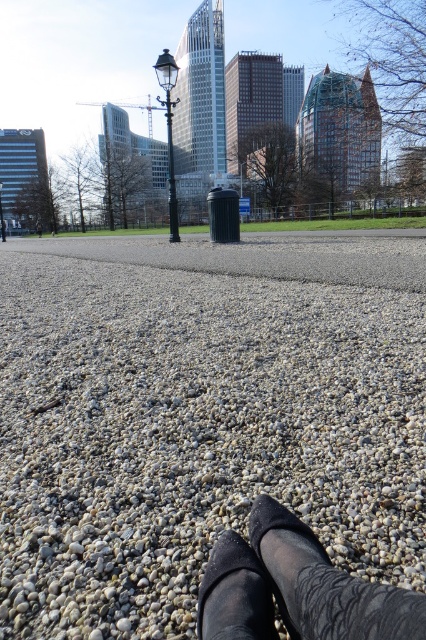
Question: Does gray pebbled gravel at center appear on the left side of black fabric shoes at center?

Choices:
 (A) yes
 (B) no

Answer: (A)

Question: Can you confirm if black fabric shoes at center is smaller than black suede shoe at lower center?

Choices:
 (A) yes
 (B) no

Answer: (B)

Question: Which point is closer to the camera?

Choices:
 (A) black fabric shoes at center
 (B) gray pebbled gravel at center

Answer: (A)

Question: Among these points, which one is nearest to the camera?

Choices:
 (A) (198, 628)
 (B) (37, 582)
 (C) (399, 628)

Answer: (C)

Question: Based on their relative distances, which object is farther from the black fabric shoes at center?

Choices:
 (A) gray pebbled gravel at center
 (B) black suede shoe at lower center

Answer: (A)

Question: Can you confirm if gray pebbled gravel at center is positioned to the right of black suede shoe at lower center?

Choices:
 (A) yes
 (B) no

Answer: (B)